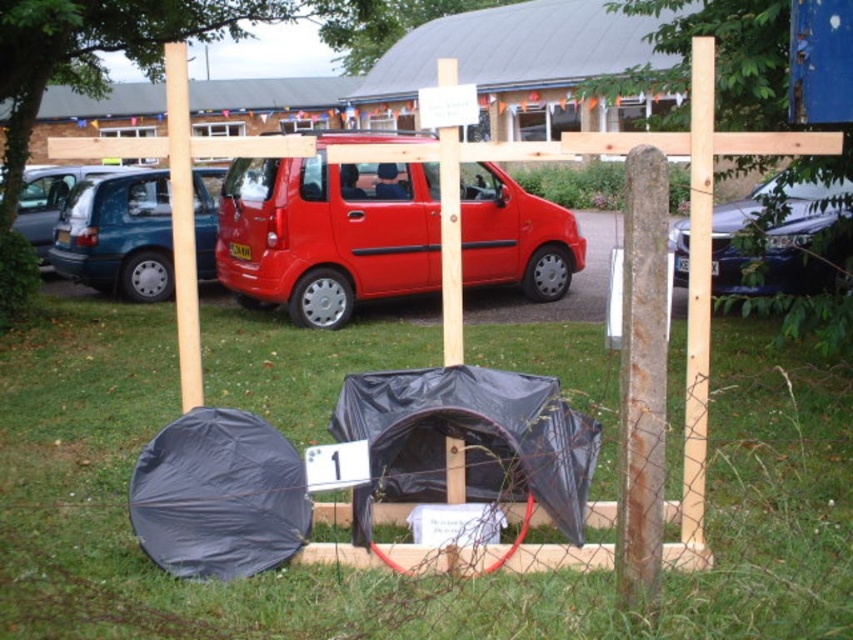
Looking at this image, you are organizing an outdoor event and need to know if the black tarpaulin tent at center can fit inside the metallic blue van at left. Based on the scene, can the tent fit inside the van?

The black tarpaulin tent at center is smaller than the metallic blue van at left, so it can fit inside the van.

You are standing at the center of the image and want to locate the matte blue minivan at left. Which direction should you look to find it?

You should look to your left to find the matte blue minivan at left since it is located at the left side of the image.